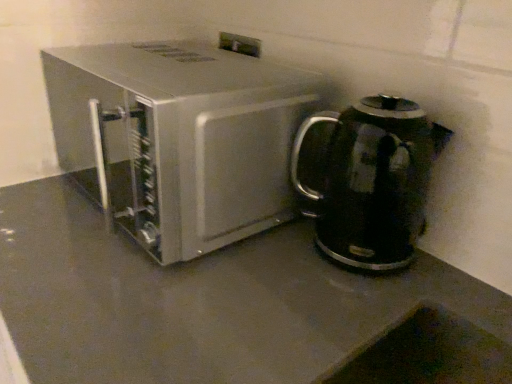
Question: In terms of width, does black glossy electric kettle at right, which is the second kitchen appliance from left to right, look wider or thinner when compared to satin silver microwave at center, the first kitchen appliance from the left?

Choices:
 (A) wide
 (B) thin

Answer: (B)

Question: From a real-world perspective, is black glossy electric kettle at right, which is the second kitchen appliance from left to right, above or below satin silver microwave at center, the first kitchen appliance from the left?

Choices:
 (A) below
 (B) above

Answer: (A)

Question: Relative to satin silver microwave at center, the first kitchen appliance from the left, is black glossy electric kettle at right, which appears as the first kitchen appliance when viewed from the right, in front or behind?

Choices:
 (A) behind
 (B) front

Answer: (A)

Question: From the image's perspective, is satin silver microwave at center, the first kitchen appliance from the left, positioned above or below black glossy electric kettle at right, which is the second kitchen appliance from left to right?

Choices:
 (A) below
 (B) above

Answer: (B)

Question: Relative to black glossy electric kettle at right, which is the second kitchen appliance from left to right, is satin silver microwave at center, the first kitchen appliance from the left, in front or behind?

Choices:
 (A) behind
 (B) front

Answer: (B)

Question: Is satin silver microwave at center, acting as the second kitchen appliance starting from the right, taller or shorter than black glossy electric kettle at right, which appears as the first kitchen appliance when viewed from the right?

Choices:
 (A) tall
 (B) short

Answer: (A)

Question: Considering the relative positions of satin silver microwave at center, acting as the second kitchen appliance starting from the right, and black glossy electric kettle at right, which appears as the first kitchen appliance when viewed from the right, in the image provided, is satin silver microwave at center, acting as the second kitchen appliance starting from the right, to the left or to the right of black glossy electric kettle at right, which appears as the first kitchen appliance when viewed from the right,?

Choices:
 (A) left
 (B) right

Answer: (A)